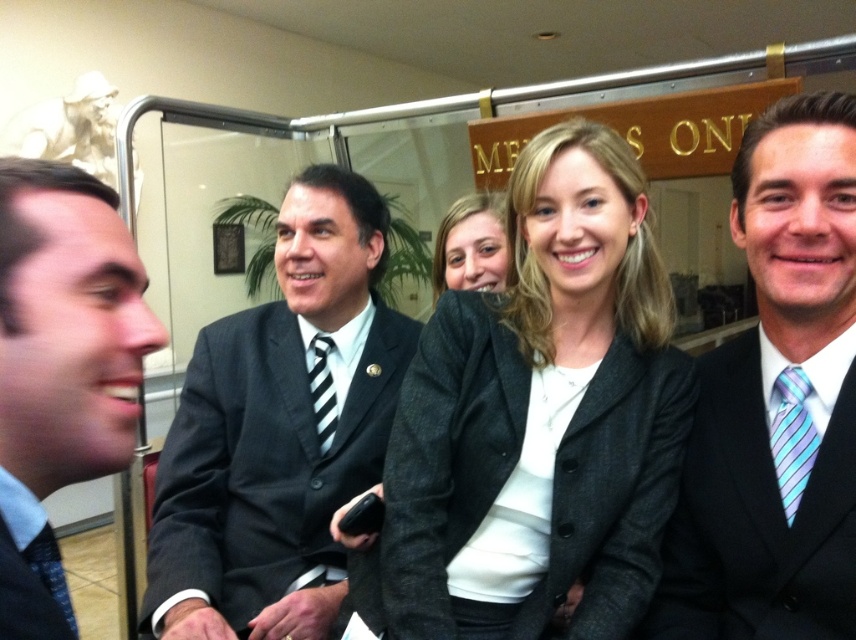
Question: Which is farther from the black striped tie at center?

Choices:
 (A) matte black suit at center
 (B) charcoal wool blazer at center

Answer: (A)

Question: Is striped silk tie at right above black striped tie at center?

Choices:
 (A) no
 (B) yes

Answer: (A)

Question: Does dark gray suit at center have a lesser width compared to matte black suit at left?

Choices:
 (A) yes
 (B) no

Answer: (B)

Question: Is striped silk tie at right in front of black striped tie at center?

Choices:
 (A) yes
 (B) no

Answer: (A)

Question: Which object is farther from the camera taking this photo?

Choices:
 (A) matte black suit at left
 (B) matte black suit at center
 (C) dark gray suit at center
 (D) black striped tie at center

Answer: (D)

Question: Which object is the closest to the dark gray suit at center?

Choices:
 (A) black striped tie at center
 (B) matte black suit at center
 (C) striped silk tie at right
 (D) charcoal wool blazer at center

Answer: (A)